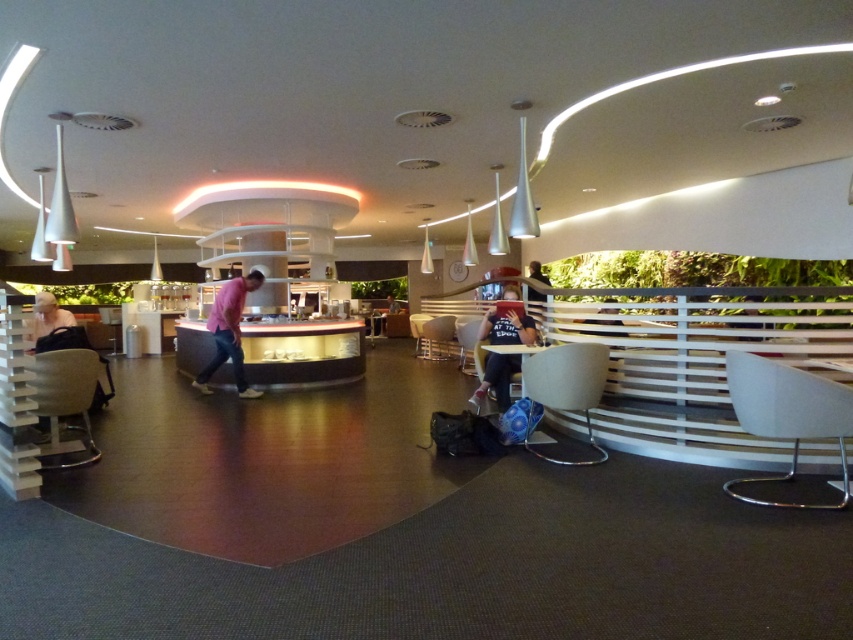
Is pink cotton shirt at center thinner than matte black jacket at left?

No, pink cotton shirt at center is not thinner than matte black jacket at left.

Between point (238, 342) and point (45, 321), which one is positioned behind?

Point (238, 342)

At what (x,y) coordinates should I click in order to perform the action: click on pink cotton shirt at center. Please return your answer as a coordinate pair (x, y). Looking at the image, I should click on (229, 332).

Is pink cotton shirt at center further to the viewer compared to matte black shirt at center?

Yes, pink cotton shirt at center is further from the viewer.

Is pink cotton shirt at center shorter than matte black shirt at center?

In fact, pink cotton shirt at center may be taller than matte black shirt at center.

Is point (251, 394) closer to camera compared to point (495, 365)?

No, it is behind (495, 365).

Identify the location of pink cotton shirt at center. (229, 332).

Does matte black shirt at center appear over dark blue jeans at center?

No, matte black shirt at center is not above dark blue jeans at center.

Is point (502, 387) less distant than point (526, 296)?

Yes.

Is point (505, 388) farther from camera compared to point (537, 269)?

No, (505, 388) is in front of (537, 269).

Locate an element on the screen. matte black shirt at center is located at coordinates (508, 326).